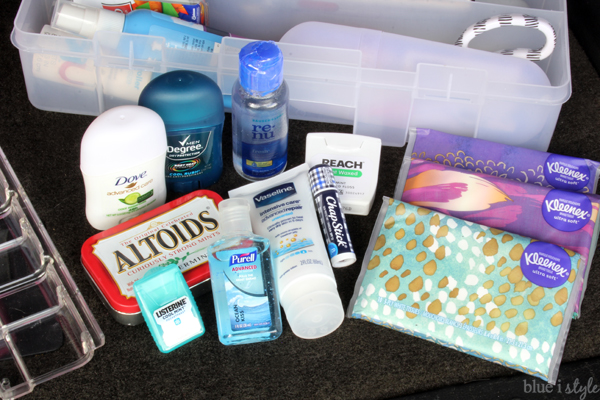
Where is `hand sanitizer`? The height and width of the screenshot is (400, 600). hand sanitizer is located at coordinates (263, 103).